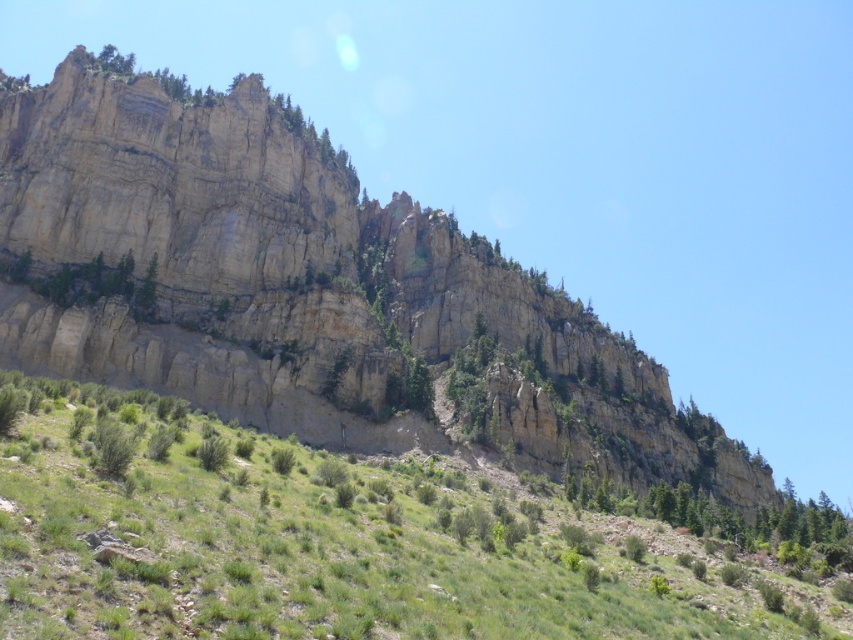
Is point (659, 420) closer to camera compared to point (74, 296)?

No, (659, 420) is further to viewer.

Does point (567, 412) lie in front of point (82, 262)?

No, it is behind (82, 262).

I want to click on rugged stone mountain at upper center, so (x=312, y=291).

Between rugged stone mountain at upper center and green grassy hillside at lower center, which one appears on the right side from the viewer's perspective?

Positioned to the right is green grassy hillside at lower center.

Between point (601, 410) and point (482, 568), which one is positioned behind?

The point (601, 410) is behind.

Which is in front, point (245, 365) or point (422, 545)?

Point (422, 545) is in front.

Where is `rugged stone mountain at upper center`? Image resolution: width=853 pixels, height=640 pixels. rugged stone mountain at upper center is located at coordinates (312, 291).

Is green grassy hillside at lower center positioned in front of green matte tree at center?

That is True.

Does point (315, 509) come in front of point (50, 285)?

Yes.

Which is in front, point (302, 625) or point (78, 289)?

Point (302, 625)

Find the location of a particular element. The image size is (853, 640). green grassy hillside at lower center is located at coordinates (364, 541).